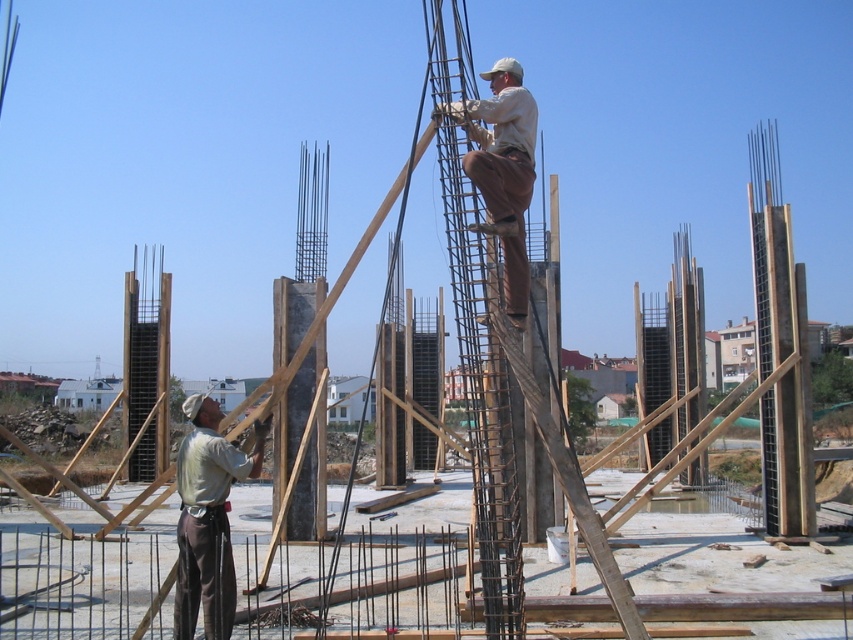
Question: Among these objects, which one is farthest from the camera?

Choices:
 (A) brown cotton pants at upper center
 (B) gray cotton shirt at lower left

Answer: (B)

Question: Is rusty metal ladder at center positioned at the back of brown cotton pants at upper center?

Choices:
 (A) yes
 (B) no

Answer: (A)

Question: Based on their relative distances, which object is nearer to the gray cotton shirt at lower left?

Choices:
 (A) brown cotton pants at upper center
 (B) rusty metal ladder at center

Answer: (B)

Question: Can you confirm if rusty metal ladder at center is wider than gray cotton shirt at lower left?

Choices:
 (A) no
 (B) yes

Answer: (B)

Question: Is rusty metal ladder at center above brown cotton pants at upper center?

Choices:
 (A) no
 (B) yes

Answer: (B)

Question: Which object is the farthest from the brown cotton pants at upper center?

Choices:
 (A) gray cotton shirt at lower left
 (B) rusty metal ladder at center

Answer: (A)